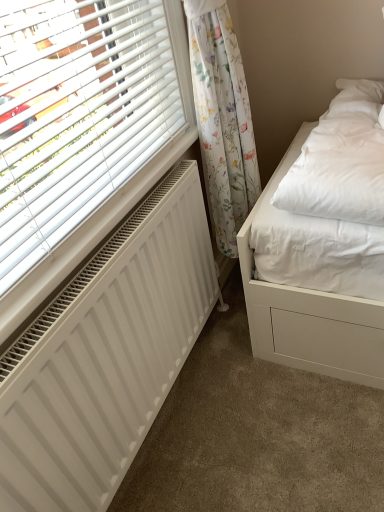
Question: Visually, is floral fabric curtain at upper right positioned to the left or to the right of white matte radiator at lower left?

Choices:
 (A) left
 (B) right

Answer: (B)

Question: Based on their sizes in the image, would you say floral fabric curtain at upper right is bigger or smaller than white matte radiator at lower left?

Choices:
 (A) small
 (B) big

Answer: (B)

Question: Does point (218, 20) appear closer or farther from the camera than point (79, 454)?

Choices:
 (A) farther
 (B) closer

Answer: (A)

Question: Looking at the image, does white matte radiator at lower left seem bigger or smaller compared to floral fabric curtain at upper right?

Choices:
 (A) big
 (B) small

Answer: (B)

Question: From a real-world perspective, is white matte radiator at lower left positioned above or below floral fabric curtain at upper right?

Choices:
 (A) above
 (B) below

Answer: (B)

Question: Relative to floral fabric curtain at upper right, is white matte radiator at lower left in front or behind?

Choices:
 (A) behind
 (B) front

Answer: (B)

Question: In the image, is white matte radiator at lower left on the left side or the right side of floral fabric curtain at upper right?

Choices:
 (A) right
 (B) left

Answer: (B)